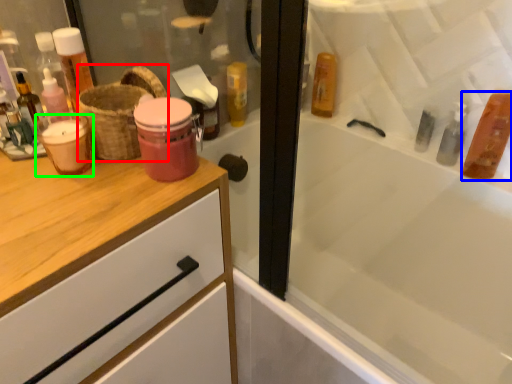
Question: Which object is positioned farthest from basket (highlighted by a red box)? Select from mouthwash (highlighted by a blue box) and mouthwash (highlighted by a green box).

Choices:
 (A) mouthwash
 (B) mouthwash

Answer: (A)